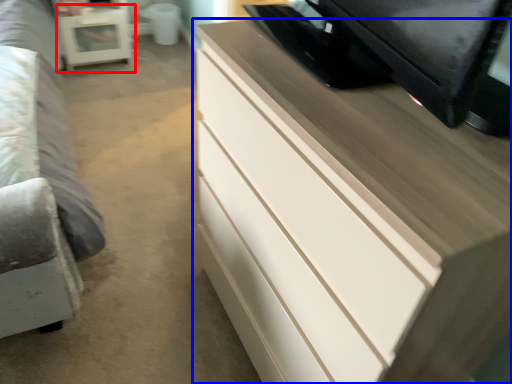
Question: Which object appears closest to the camera in this image, table (highlighted by a red box) or chest of drawers (highlighted by a blue box)?

Choices:
 (A) table
 (B) chest of drawers

Answer: (B)